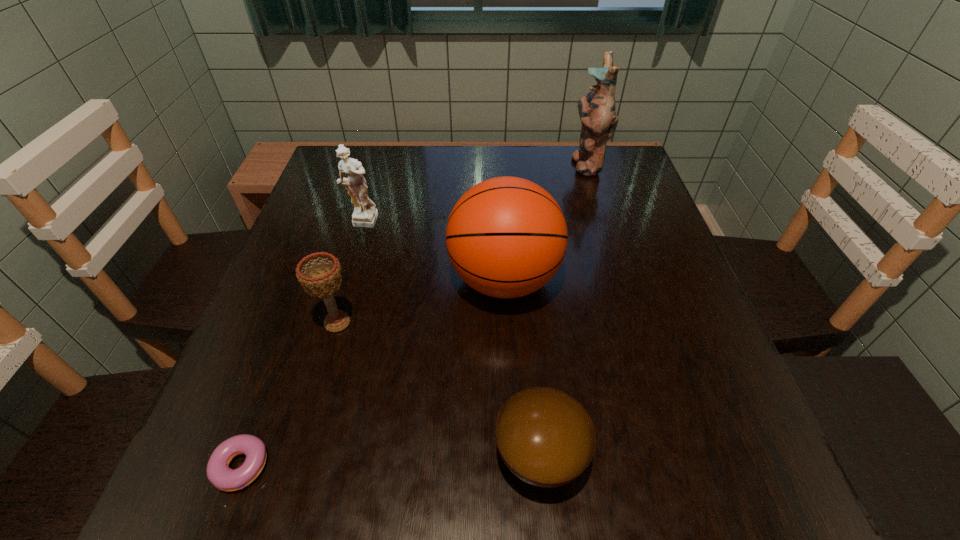
Identify the location of free space located on the front-facing side of the rightmost object. The height and width of the screenshot is (540, 960). (497, 164).

This screenshot has width=960, height=540. I want to click on vacant region located on the back of the basketball, so click(497, 152).

I want to click on free space located on the front-facing side of the left figurine, so [x=315, y=381].

Where is `free location located 0.280m on the front of the third shortest object`? free location located 0.280m on the front of the third shortest object is located at coordinates 286,503.

The image size is (960, 540). Identify the location of vacant space located 0.350m on the left of the fifth tallest object. [x=259, y=455].

Image resolution: width=960 pixels, height=540 pixels. In order to click on free space located on the right of the doughnut in this screenshot , I will do [514, 474].

At what (x,y) coordinates should I click in order to perform the action: click on object positioned at the far edge. Please return your answer as a coordinate pair (x, y). The width and height of the screenshot is (960, 540). Looking at the image, I should click on (597, 110).

The height and width of the screenshot is (540, 960). In order to click on bowl located at the near edge in this screenshot , I will do `click(545, 437)`.

Where is `doughnut that is at the near edge`? This screenshot has width=960, height=540. doughnut that is at the near edge is located at coordinates (219, 474).

Where is `figurine that is at the left edge`? This screenshot has width=960, height=540. figurine that is at the left edge is located at coordinates (365, 215).